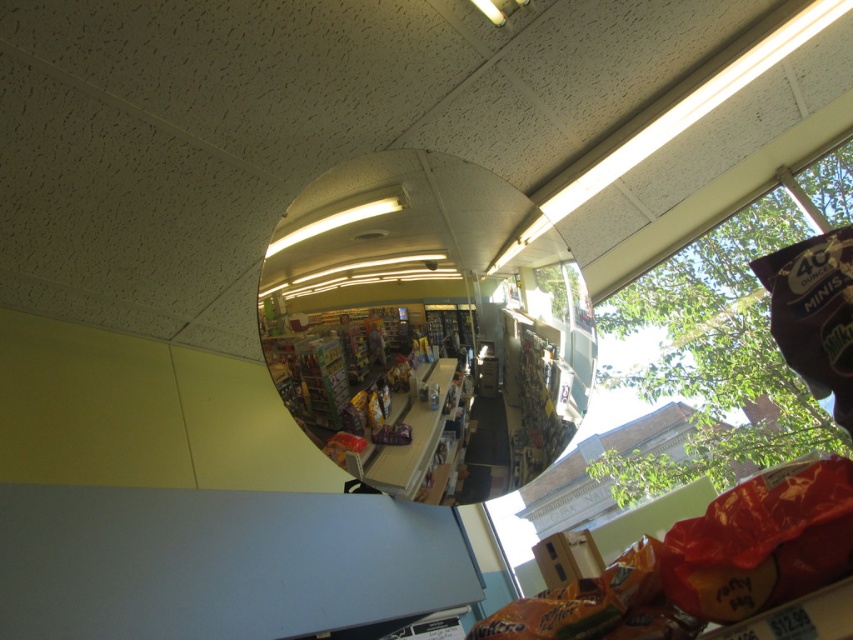
Who is more forward, (318, 326) or (718, 538)?

A: Positioned in front is point (718, 538).

Does point (431, 305) come closer to viewer compared to point (850, 492)?

No, (431, 305) is further to viewer.

Where is `clear glass mirror at center`? The image size is (853, 640). clear glass mirror at center is located at coordinates (421, 326).